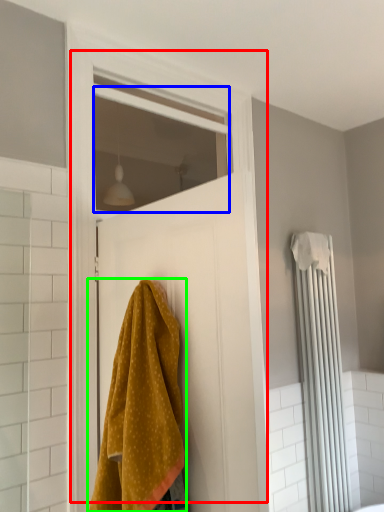
Question: Which object is the farthest from door (highlighted by a red box)? Choose among these: window (highlighted by a blue box) or towel (highlighted by a green box).

Choices:
 (A) window
 (B) towel

Answer: (A)